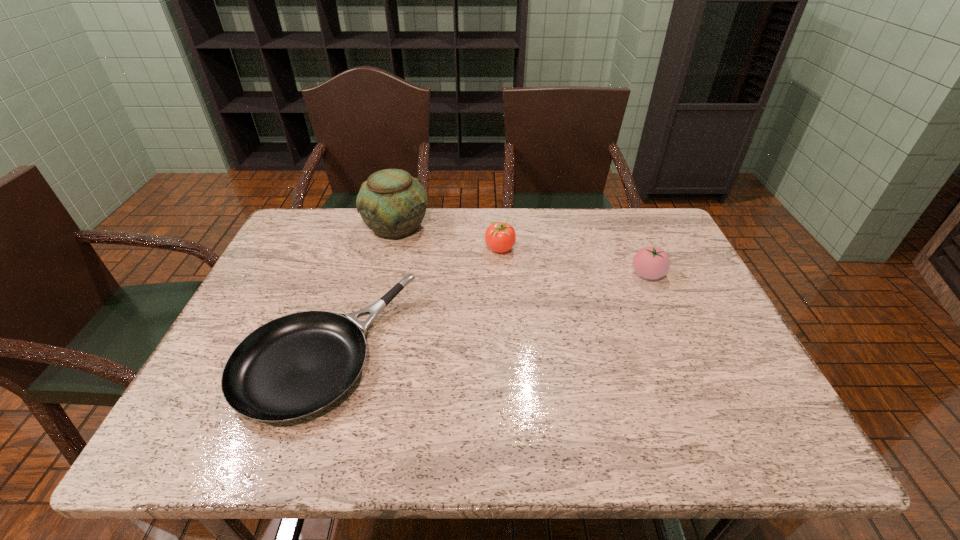
Locate an element on the screen. This screenshot has width=960, height=540. vacant space at the far left corner is located at coordinates (322, 238).

The width and height of the screenshot is (960, 540). What are the coordinates of `vacant region between the left tomato and the tallest object` in the screenshot? It's located at (448, 238).

This screenshot has height=540, width=960. I want to click on free space between the nearer tomato and the third object from left to right, so click(574, 261).

In order to click on vacant point located between the rightmost object and the pottery in this screenshot , I will do `click(522, 251)`.

The width and height of the screenshot is (960, 540). What are the coordinates of `unoccupied area between the rightmost object and the pan` in the screenshot? It's located at (487, 313).

The width and height of the screenshot is (960, 540). In order to click on free point between the shortest object and the farther tomato in this screenshot , I will do `click(413, 300)`.

The image size is (960, 540). I want to click on unoccupied position between the farther tomato and the pottery, so click(448, 238).

At what (x,y) coordinates should I click in order to perform the action: click on vacant point located between the third object from left to right and the third farthest object. Please return your answer as a coordinate pair (x, y). The height and width of the screenshot is (540, 960). Looking at the image, I should click on (574, 261).

The height and width of the screenshot is (540, 960). I want to click on empty space that is in between the left tomato and the pottery, so click(x=448, y=238).

Find the location of a particular element. The image size is (960, 540). vacant area that lies between the rightmost object and the left tomato is located at coordinates (574, 261).